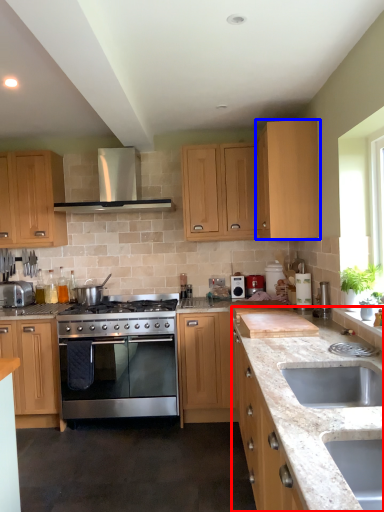
Question: Which object is further to the camera taking this photo, counter (highlighted by a red box) or cabinetry (highlighted by a blue box)?

Choices:
 (A) counter
 (B) cabinetry

Answer: (B)